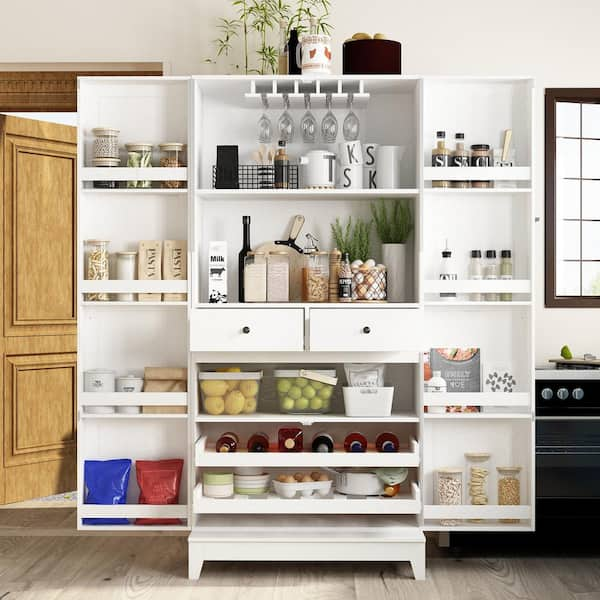
Locate an element on the screen. bottles is located at coordinates (225, 442), (258, 441), (324, 445), (355, 444), (385, 442), (246, 229), (279, 149), (441, 151), (462, 151).